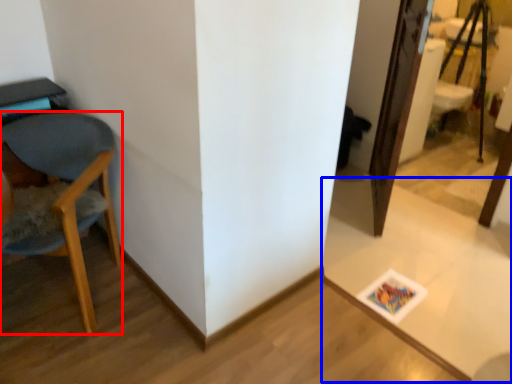
Question: Which of the following is the farthest to the observer, chair (highlighted by a red box) or table (highlighted by a blue box)?

Choices:
 (A) chair
 (B) table

Answer: (B)